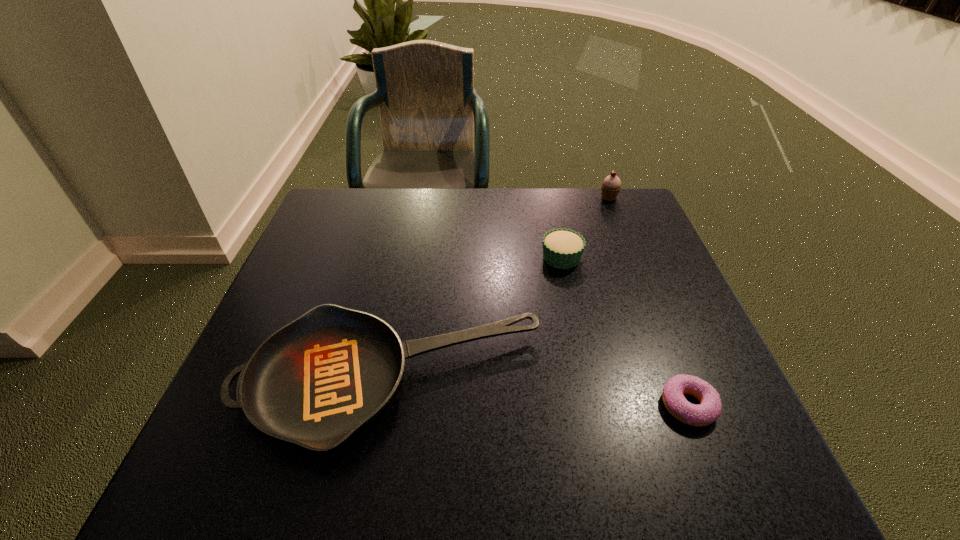
The width and height of the screenshot is (960, 540). I want to click on free space at the left edge of the desktop, so click(347, 280).

This screenshot has height=540, width=960. In order to click on free space at the right edge in this screenshot , I will do `click(727, 410)`.

Image resolution: width=960 pixels, height=540 pixels. In the image, there is a desktop. What are the coordinates of `vacant area at the far left corner` in the screenshot? It's located at (333, 199).

At what (x,y) coordinates should I click in order to perform the action: click on vacant space at the near left corner of the desktop. Please return your answer as a coordinate pair (x, y). Image resolution: width=960 pixels, height=540 pixels. Looking at the image, I should click on (265, 447).

Identify the location of vacant region at the far right corner of the desktop. (587, 214).

Identify the location of unoccupied area between the shortest object and the left cupcake. (x=625, y=332).

Locate an element on the screen. The width and height of the screenshot is (960, 540). free space between the doughnut and the third tallest object is located at coordinates (540, 394).

Where is `vacant point located between the second object from left to right and the third tallest object`? vacant point located between the second object from left to right and the third tallest object is located at coordinates (476, 320).

Identify the location of free point between the nearer cupcake and the frying pan. This screenshot has height=540, width=960. (476, 320).

At what (x,y) coordinates should I click in order to perform the action: click on free spot between the frying pan and the left cupcake. Please return your answer as a coordinate pair (x, y). Looking at the image, I should click on (476, 320).